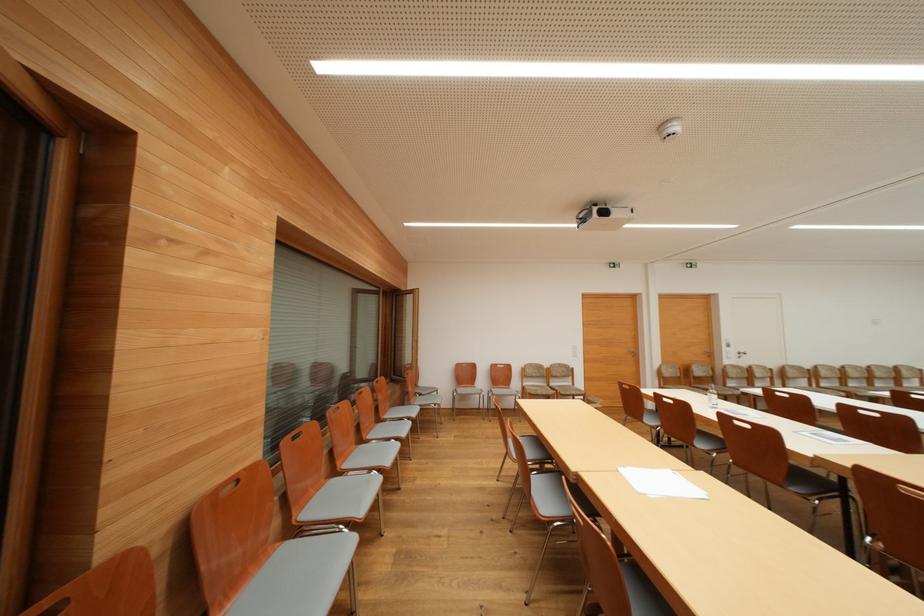
Find where to grasp the white paper stack. Please return your answer as a coordinate pair (x, y).

(661, 483)